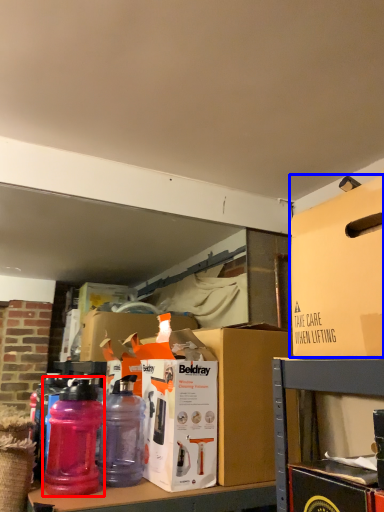
Question: Which object appears closest to the camera in this image, bottle (highlighted by a red box) or box (highlighted by a blue box)?

Choices:
 (A) bottle
 (B) box

Answer: (B)